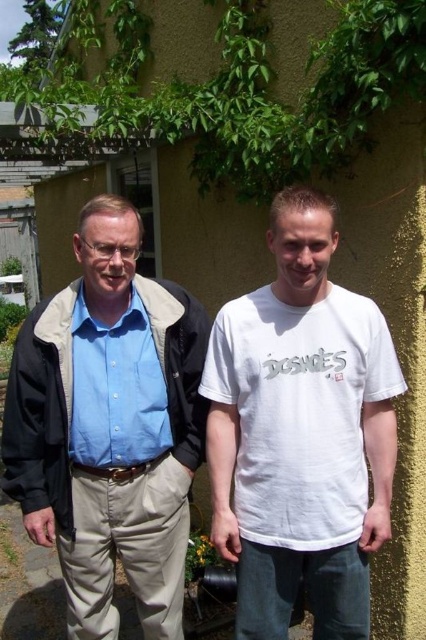
From the picture: You are a photographer planning to take a photo of the blue cotton shirt at center and the green leafy ivy at upper center. Which object is shorter in the scene?

The blue cotton shirt at center is shorter than the green leafy ivy at upper center.

Based on the photo, you are a painter standing 2 meters away from the textured yellow wall. You want to paint the green leafy ivy at upper center. Can you reach it without moving closer?

The green leafy ivy at upper center is 2.23 meters from the viewer. Since you are 2 meters away, you are 0.23 meters too far to reach it without moving closer. You need to step forward to reduce the distance.